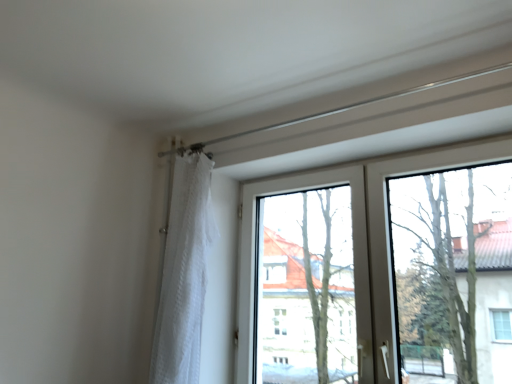
Question: Is transparent glass tree at upper right at the back of white sheer curtain at left?

Choices:
 (A) no
 (B) yes

Answer: (A)

Question: Would you consider white sheer curtain at left to be distant from transparent glass tree at upper right?

Choices:
 (A) yes
 (B) no

Answer: (A)

Question: Considering the relative sizes of white sheer curtain at left and transparent glass tree at upper right in the image provided, is white sheer curtain at left shorter than transparent glass tree at upper right?

Choices:
 (A) no
 (B) yes

Answer: (A)

Question: Is white sheer curtain at left oriented towards transparent glass tree at upper right?

Choices:
 (A) no
 (B) yes

Answer: (A)

Question: Would you say white sheer curtain at left is outside transparent glass tree at upper right?

Choices:
 (A) yes
 (B) no

Answer: (A)

Question: Relative to transparent glass window at center, is transparent glass tree at upper right in front or behind?

Choices:
 (A) behind
 (B) front

Answer: (B)

Question: Looking at the image, does transparent glass tree at upper right seem bigger or smaller compared to transparent glass window at center?

Choices:
 (A) big
 (B) small

Answer: (B)

Question: From the image's perspective, is transparent glass tree at upper right located above or below transparent glass window at center?

Choices:
 (A) below
 (B) above

Answer: (B)

Question: Would you say transparent glass tree at upper right is inside or outside transparent glass window at center?

Choices:
 (A) outside
 (B) inside

Answer: (A)

Question: Based on their positions, is white sheer curtain at left located to the left or right of transparent glass tree at upper right?

Choices:
 (A) left
 (B) right

Answer: (A)

Question: Is white sheer curtain at left taller or shorter than transparent glass tree at upper right?

Choices:
 (A) short
 (B) tall

Answer: (B)

Question: Looking at the image, does white sheer curtain at left seem bigger or smaller compared to transparent glass tree at upper right?

Choices:
 (A) small
 (B) big

Answer: (B)

Question: From a real-world perspective, is white sheer curtain at left physically located above or below transparent glass tree at upper right?

Choices:
 (A) below
 (B) above

Answer: (A)

Question: From a real-world perspective, is transparent glass window at center positioned above or below transparent glass tree at upper right?

Choices:
 (A) below
 (B) above

Answer: (A)

Question: Is point (372, 359) positioned closer to the camera than point (398, 304)?

Choices:
 (A) farther
 (B) closer

Answer: (A)